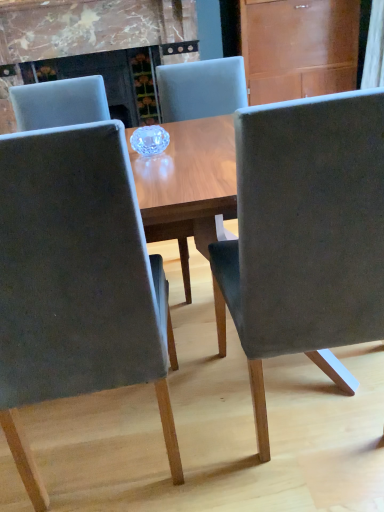
This screenshot has width=384, height=512. Identify the location of free space to the left of suede-like gray chair at center, arranged as the 1th chair when viewed from the right. (209, 420).